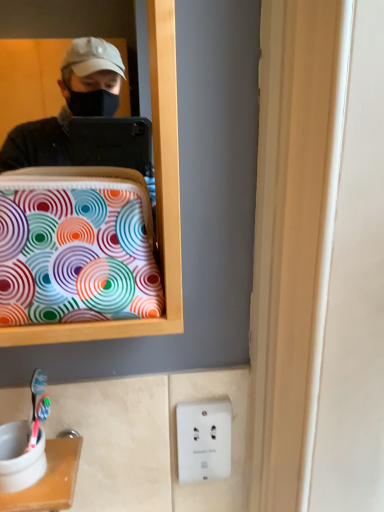
Find the location of a particular element. The image size is (384, 512). colorful fabric bag at left is located at coordinates (75, 257).

Which is less distant, (60, 489) or (186, 420)?

The point (60, 489) is in front.

How different are the orientations of white plastic toothbrush holder at lower left and white plastic electric outlet at lower center in degrees?

The angle between the facing direction of white plastic toothbrush holder at lower left and the facing direction of white plastic electric outlet at lower center is 2.85 degrees.

From a real-world perspective, which is physically above, white plastic toothbrush holder at lower left or white plastic electric outlet at lower center?

From a 3D spatial view, white plastic toothbrush holder at lower left is above.

Considering the sizes of objects white plastic toothbrush holder at lower left and white plastic electric outlet at lower center in the image provided, who is thinner, white plastic toothbrush holder at lower left or white plastic electric outlet at lower center?

Thinner between the two is white plastic electric outlet at lower center.

How different are the orientations of white plastic electric outlet at lower center and white plastic toothbrush holder at lower left in degrees?

2.85 degrees.

Does white plastic electric outlet at lower center come in front of white plastic toothbrush holder at lower left?

No, it is behind white plastic toothbrush holder at lower left.

Is white plastic electric outlet at lower center positioned with its back to white plastic toothbrush holder at lower left?

No.

From the image's perspective, who appears lower, white plastic electric outlet at lower center or white plastic toothbrush holder at lower left?

white plastic electric outlet at lower center, from the image's perspective.

Considering the relative sizes of white plastic electric outlet at lower center and colorful fabric bag at left in the image provided, is white plastic electric outlet at lower center wider than colorful fabric bag at left?

No.

How far apart are white plastic electric outlet at lower center and colorful fabric bag at left?

They are 12.32 inches apart.

Does white plastic electric outlet at lower center appear on the right side of colorful fabric bag at left?

Yes, white plastic electric outlet at lower center is to the right of colorful fabric bag at left.

From the image's perspective, is white plastic electric outlet at lower center beneath colorful fabric bag at left?

Indeed, from the image's perspective, white plastic electric outlet at lower center is shown beneath colorful fabric bag at left.

From the image's perspective, relative to white plastic electric outlet at lower center, is colorful fabric bag at left above or below?

Based on their image positions, colorful fabric bag at left is located above white plastic electric outlet at lower center.

Would you say colorful fabric bag at left is to the left or to the right of white plastic electric outlet at lower center in the picture?

Based on their positions, colorful fabric bag at left is located to the left of white plastic electric outlet at lower center.

Based on the photo, is colorful fabric bag at left placed right next to white plastic electric outlet at lower center?

There is a gap between colorful fabric bag at left and white plastic electric outlet at lower center.

Is colorful fabric bag at left beside white plastic toothbrush holder at lower left?

No, colorful fabric bag at left is not touching white plastic toothbrush holder at lower left.

Which of these two, colorful fabric bag at left or white plastic toothbrush holder at lower left, is bigger?

With larger size is colorful fabric bag at left.

The width and height of the screenshot is (384, 512). What are the coordinates of `pattern that is in front of the white plastic toothbrush holder at lower left` in the screenshot? It's located at (75, 257).

Is point (74, 488) positioned after point (63, 242)?

Yes, point (74, 488) is farther from viewer.

From a real-world perspective, does white plastic toothbrush holder at lower left sit lower than colorful fabric bag at left?

Indeed, from a real-world perspective, white plastic toothbrush holder at lower left is positioned beneath colorful fabric bag at left.

Looking at this image, considering the positions of objects white plastic toothbrush holder at lower left and colorful fabric bag at left in the image provided, who is more to the left, white plastic toothbrush holder at lower left or colorful fabric bag at left?

From the viewer's perspective, white plastic toothbrush holder at lower left appears more on the left side.

From the image's perspective, between white plastic toothbrush holder at lower left and colorful fabric bag at left, who is located below?

From the image's view, white plastic toothbrush holder at lower left is below.

You are a GUI agent. You are given a task and a screenshot of the screen. Output one action in this format:
    pyautogui.click(x=<x>, y=<y>)
    Task: Click on the electric outlet lying below the white plastic toothbrush holder at lower left (from the image's perspective)
    The width and height of the screenshot is (384, 512).
    Given the screenshot: What is the action you would take?
    pyautogui.click(x=203, y=440)

Image resolution: width=384 pixels, height=512 pixels. Identify the location of electric outlet on the right of white plastic toothbrush holder at lower left. (203, 440).

Based on their spatial positions, is white plastic toothbrush holder at lower left or colorful fabric bag at left closer to white plastic electric outlet at lower center?

white plastic toothbrush holder at lower left is positioned closer to the anchor white plastic electric outlet at lower center.

Estimate the real-world distances between objects in this image. Which object is closer to colorful fabric bag at left, white plastic electric outlet at lower center or white plastic toothbrush holder at lower left?

Among the two, white plastic toothbrush holder at lower left is located nearer to colorful fabric bag at left.

Which object lies nearer to the anchor point colorful fabric bag at left, white plastic toothbrush holder at lower left or white plastic electric outlet at lower center?

Among the two, white plastic toothbrush holder at lower left is located nearer to colorful fabric bag at left.

When comparing their distances from white plastic electric outlet at lower center, does colorful fabric bag at left or white plastic toothbrush holder at lower left seem closer?

white plastic toothbrush holder at lower left.

Considering their positions, is colorful fabric bag at left positioned closer to white plastic toothbrush holder at lower left than white plastic electric outlet at lower center?

The object closer to white plastic toothbrush holder at lower left is white plastic electric outlet at lower center.

In the scene shown: Which object lies nearer to the anchor point white plastic toothbrush holder at lower left, white plastic electric outlet at lower center or colorful fabric bag at left?

white plastic electric outlet at lower center is positioned closer to the anchor white plastic toothbrush holder at lower left.

At what (x,y) coordinates should I click in order to perform the action: click on furniture between colorful fabric bag at left and white plastic electric outlet at lower center in the up-down direction. Please return your answer as a coordinate pair (x, y). The height and width of the screenshot is (512, 384). Looking at the image, I should click on (50, 480).